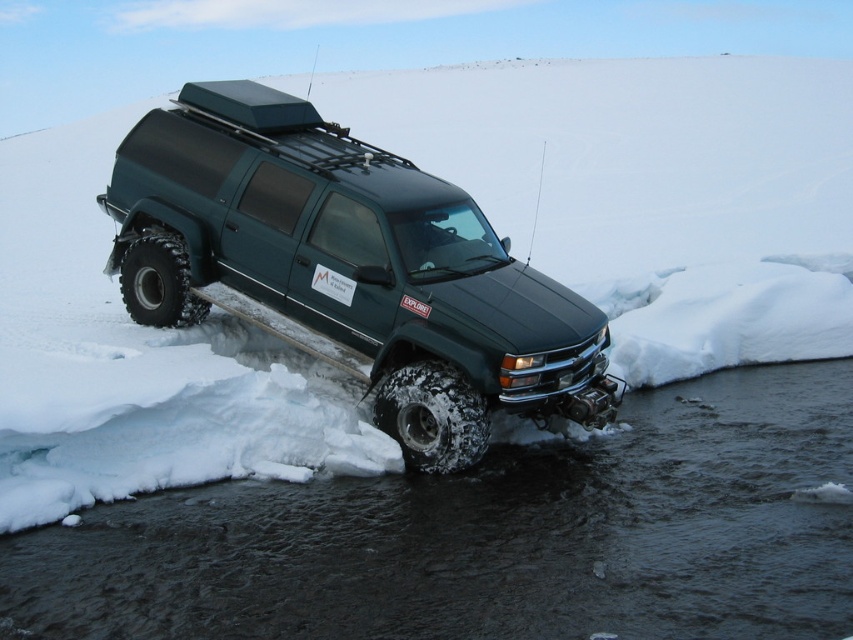
Is dark gray water at lower center thinner than green matte truck at center?

No.

Which is above, dark gray water at lower center or green matte truck at center?

green matte truck at center is above.

Where is `dark gray water at lower center`? dark gray water at lower center is located at coordinates (492, 536).